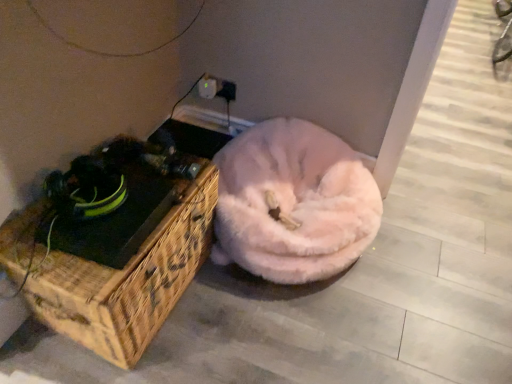
This screenshot has width=512, height=384. Identify the location of free spot to the right of fuzzy pink dog bed at center. (435, 273).